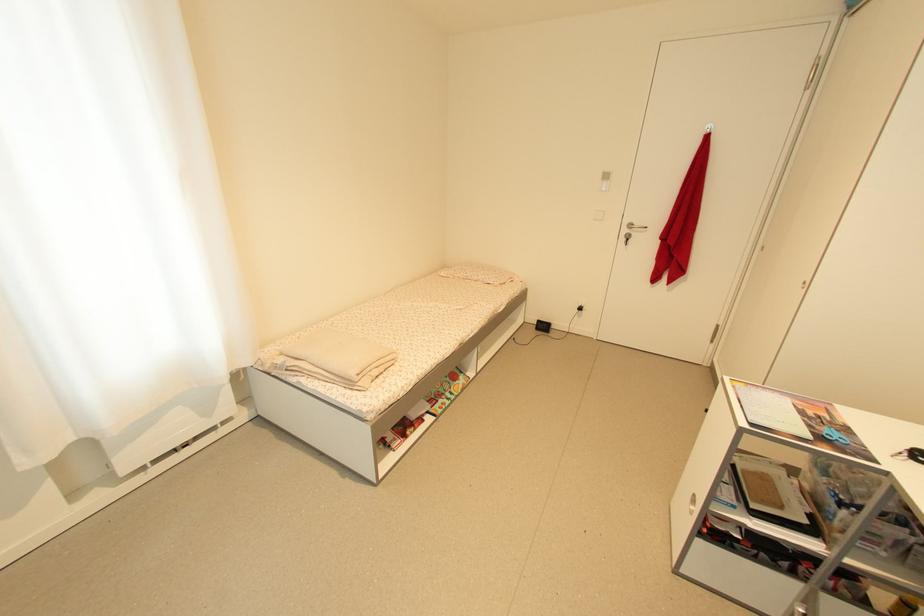
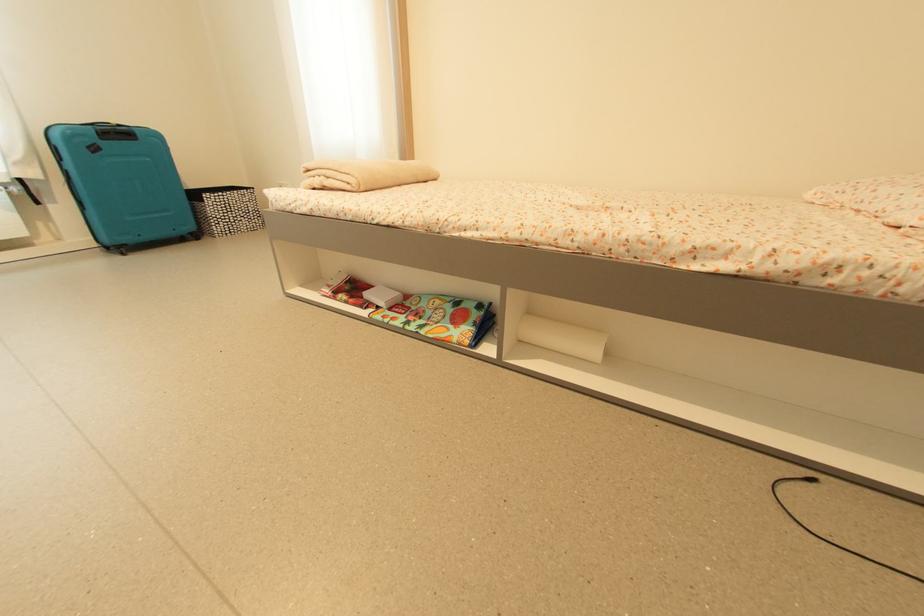
Find the pixel in the second image that matches the point at 518,341 in the first image.

(817, 483)